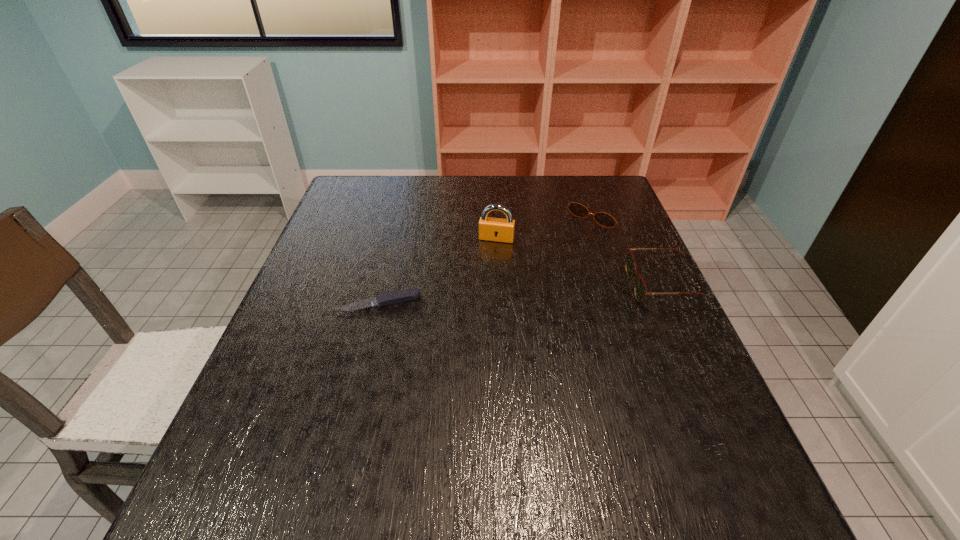
Locate an element on the screen. Image resolution: width=960 pixels, height=540 pixels. free spot between the tallest object and the steak knife is located at coordinates (438, 271).

Locate an element on the screen. vacant space that's between the third tallest object and the steak knife is located at coordinates (489, 258).

The height and width of the screenshot is (540, 960). Identify the location of free space between the padlock and the spectacles. (579, 262).

This screenshot has height=540, width=960. I want to click on empty location between the sunglasses and the padlock, so click(x=547, y=226).

You are a GUI agent. You are given a task and a screenshot of the screen. Output one action in this format:
    pyautogui.click(x=<x>, y=<y>)
    Task: Click on the unoccupied position between the shortest object and the padlock
    
    Given the screenshot: What is the action you would take?
    point(438,271)

Image resolution: width=960 pixels, height=540 pixels. Find the location of `vacant space that is in between the second object from left to right and the third shortest object`. vacant space that is in between the second object from left to right and the third shortest object is located at coordinates pos(579,262).

Identify the location of unoccupied area between the shortest object and the spectacles. (520, 294).

The width and height of the screenshot is (960, 540). In order to click on object that is the closest one to the second tallest object in this screenshot , I will do `click(577, 209)`.

Identify which object is located as the third nearest to the leftmost object. Please provide its 2D coordinates. Your answer should be formatted as a tuple, i.e. [(x, y)], where the tuple contains the x and y coordinates of a point satisfying the conditions above.

[(640, 289)]

At what (x,y) coordinates should I click in order to perform the action: click on vacant space that satisfies the following two spatial constraints: 1. on the front side of the third tallest object; 2. at the front view of the second tallest object. Please return your answer as a coordinate pair (x, y). Looking at the image, I should click on (625, 286).